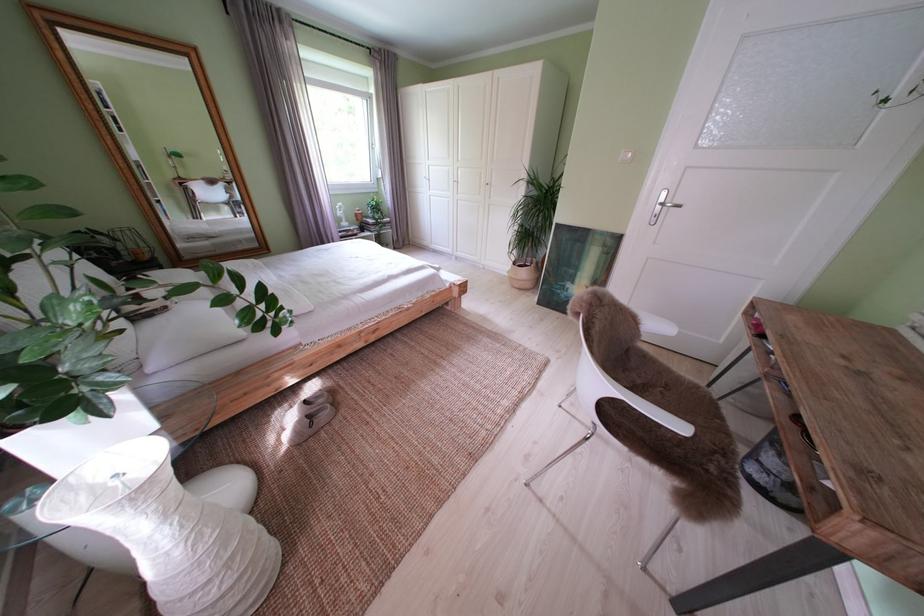
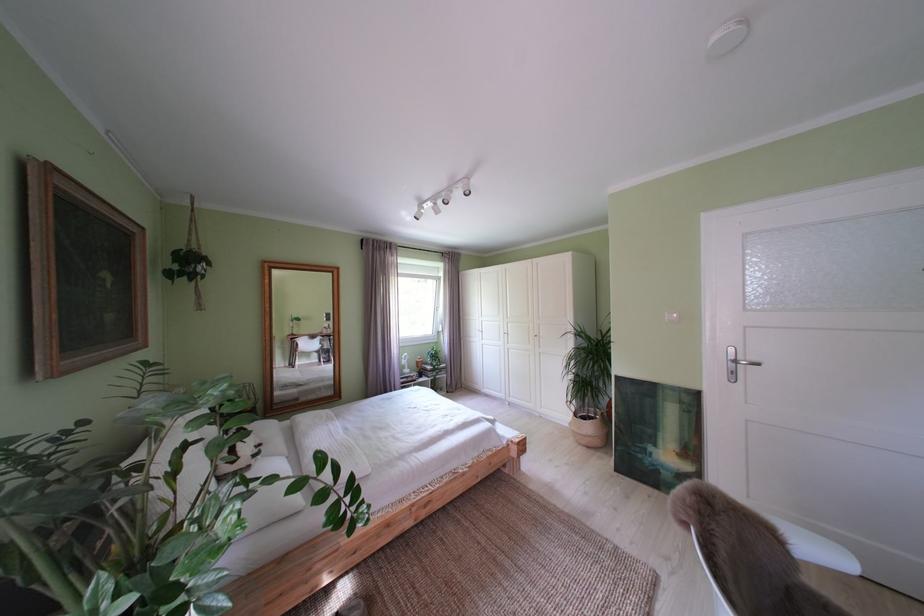
The point at [526,269] is marked in the first image. Where is the corresponding point in the second image?

(587, 419)